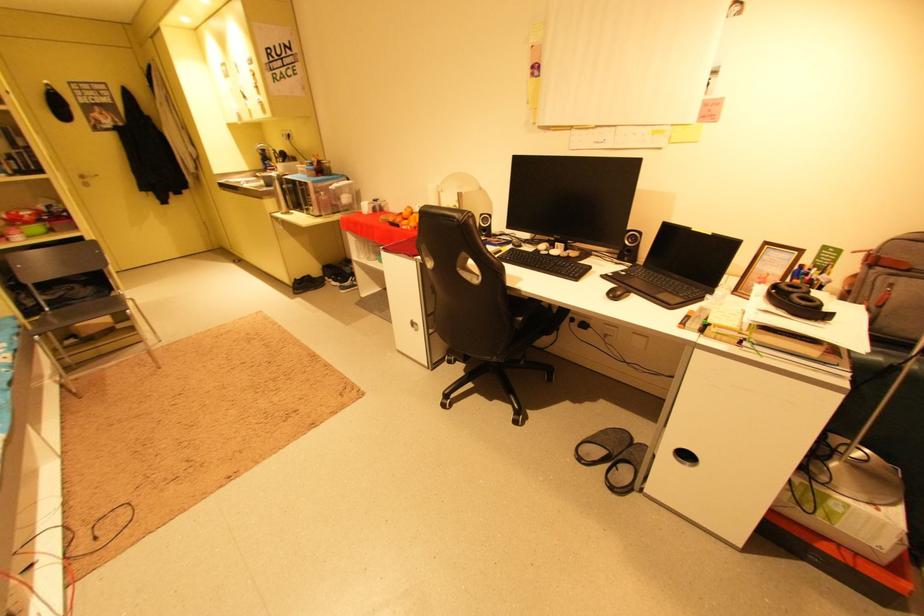
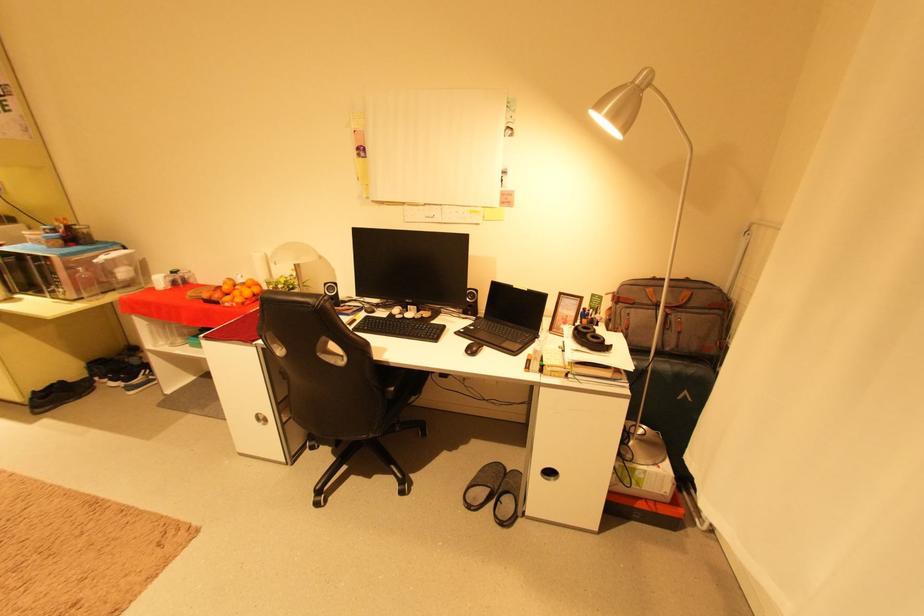
Where in the second image is the point corresponding to [638,241] from the first image?

(477, 298)